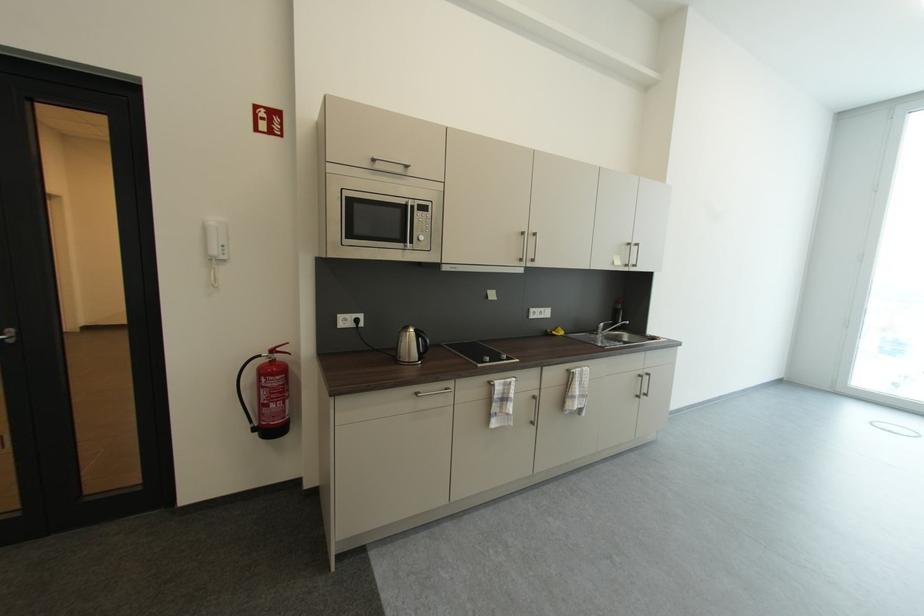
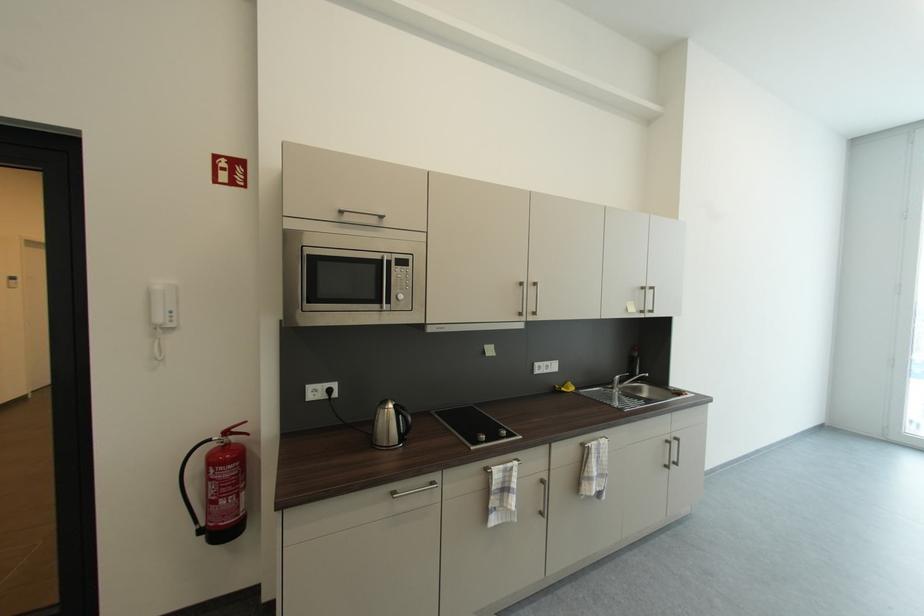
Locate, in the second image, the point that corresponds to point (641, 397) in the first image.

(670, 466)